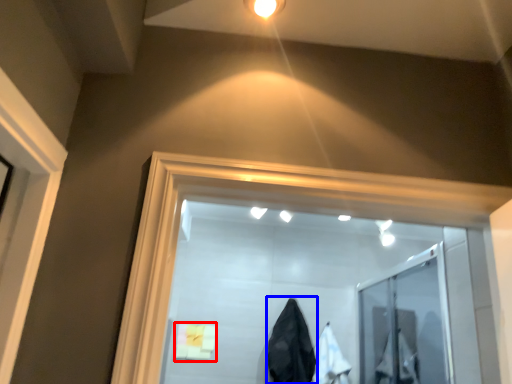
Question: Which object is further to the camera taking this photo, bath towel (highlighted by a red box) or garment (highlighted by a blue box)?

Choices:
 (A) bath towel
 (B) garment

Answer: (A)